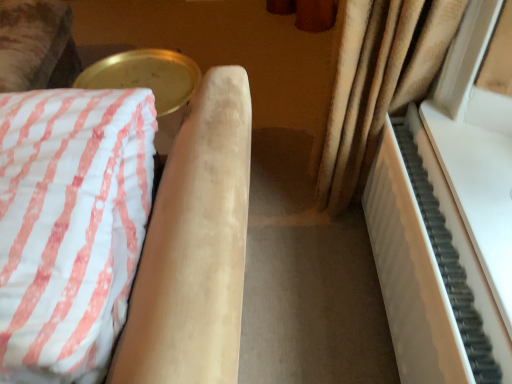
Question: Does point (145, 193) appear closer or farther from the camera than point (431, 326)?

Choices:
 (A) closer
 (B) farther

Answer: (A)

Question: In terms of width, does velvet beige armchair at left look wider or thinner when compared to white matte piano at right?

Choices:
 (A) thin
 (B) wide

Answer: (B)

Question: From the image's perspective, is velvet beige armchair at left positioned above or below white matte piano at right?

Choices:
 (A) below
 (B) above

Answer: (B)

Question: Considering the positions of white matte piano at right and velvet beige armchair at left in the image, is white matte piano at right taller or shorter than velvet beige armchair at left?

Choices:
 (A) tall
 (B) short

Answer: (B)

Question: From a real-world perspective, is white matte piano at right positioned above or below velvet beige armchair at left?

Choices:
 (A) below
 (B) above

Answer: (A)

Question: Considering the relative positions of white matte piano at right and velvet beige armchair at left in the image provided, is white matte piano at right to the left or to the right of velvet beige armchair at left?

Choices:
 (A) left
 (B) right

Answer: (B)

Question: Based on their sizes in the image, would you say white matte piano at right is bigger or smaller than velvet beige armchair at left?

Choices:
 (A) big
 (B) small

Answer: (B)